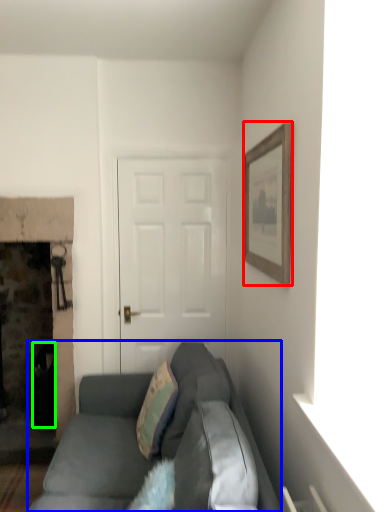
Question: Which object is positioned farthest from picture frame (highlighted by a red box)? Select from studio couch (highlighted by a blue box) and trash bin/can (highlighted by a green box).

Choices:
 (A) studio couch
 (B) trash bin/can

Answer: (B)